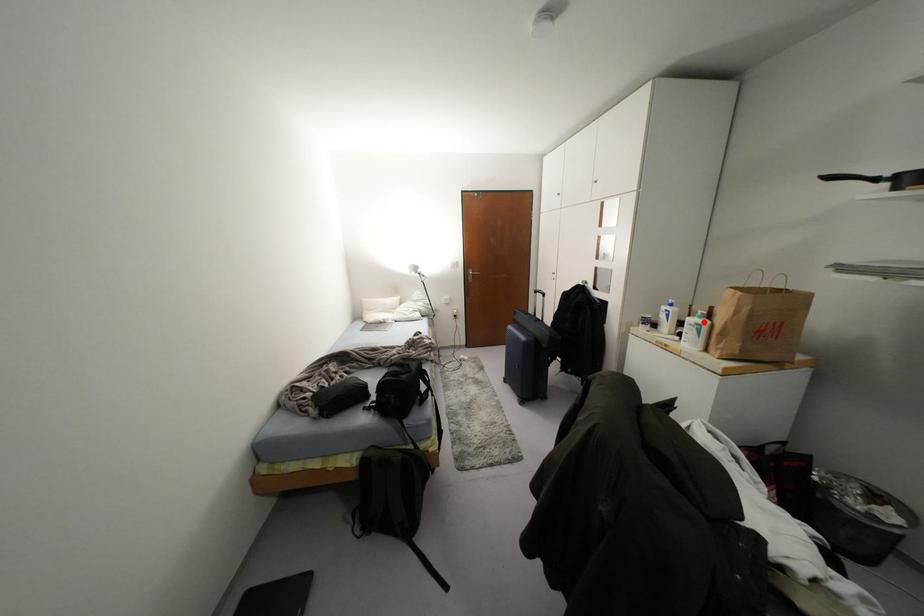
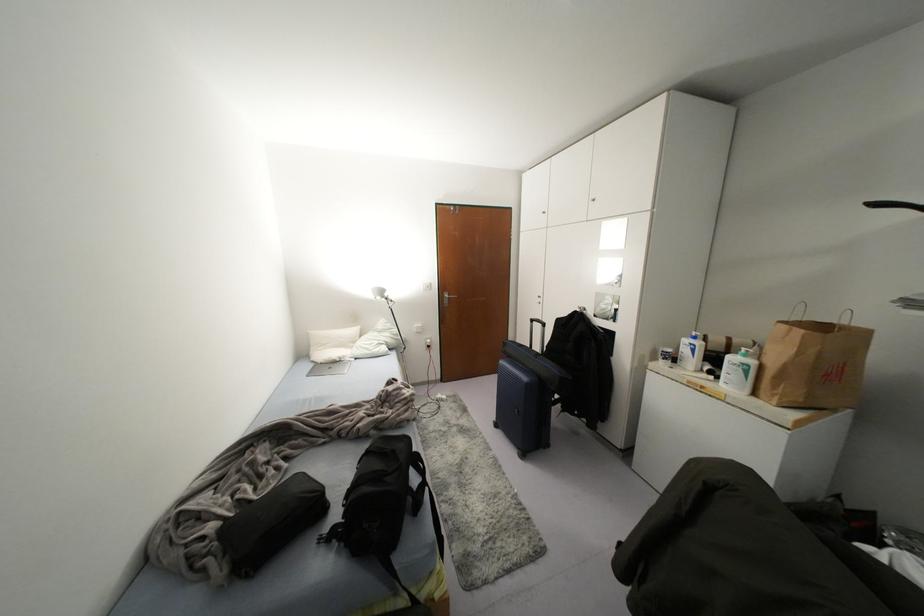
In the second image, find the point that corresponds to the highlighted location in the first image.

(751, 362)